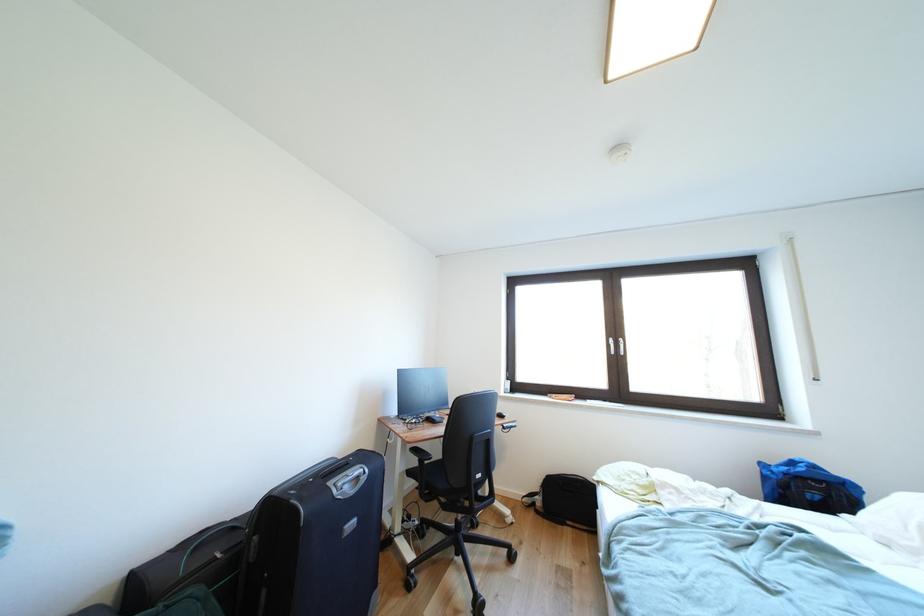
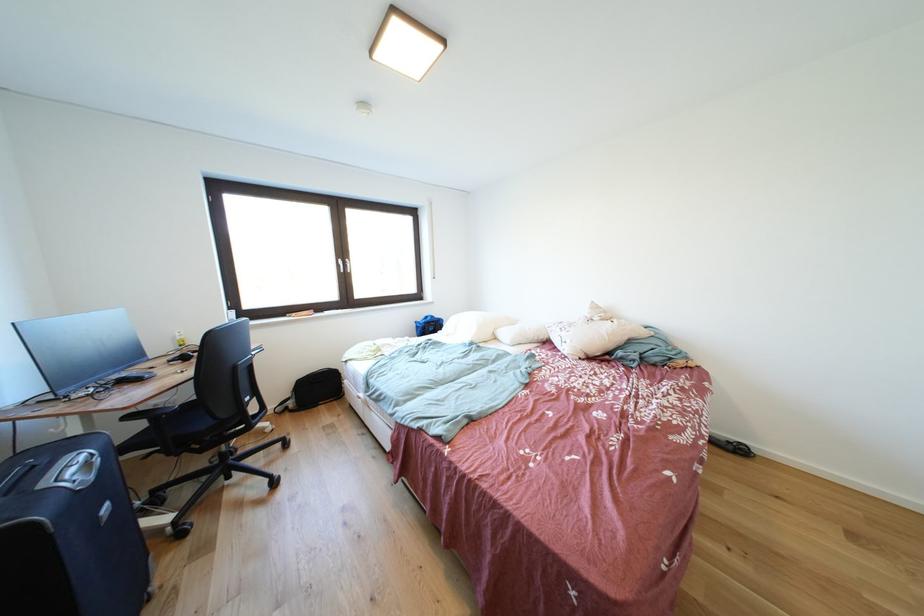
In the second image, find the point that corresponds to pixel 546 505 in the first image.

(299, 408)